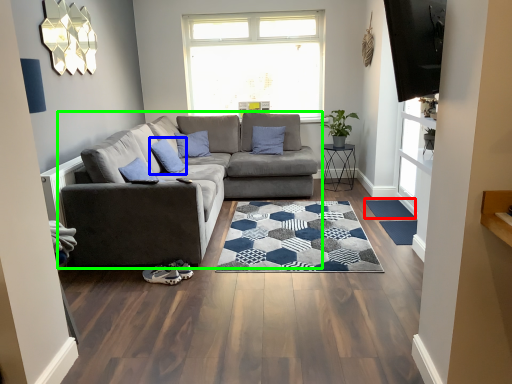
Question: Which is farther away from flat (highlighted by a red box)? pillow (highlighted by a blue box) or studio couch (highlighted by a green box)?

Choices:
 (A) pillow
 (B) studio couch

Answer: (A)